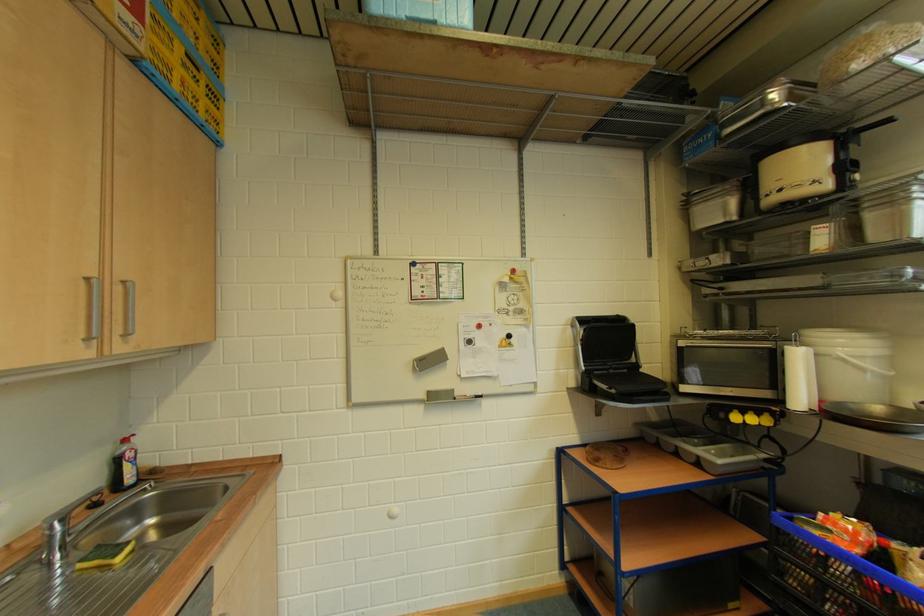
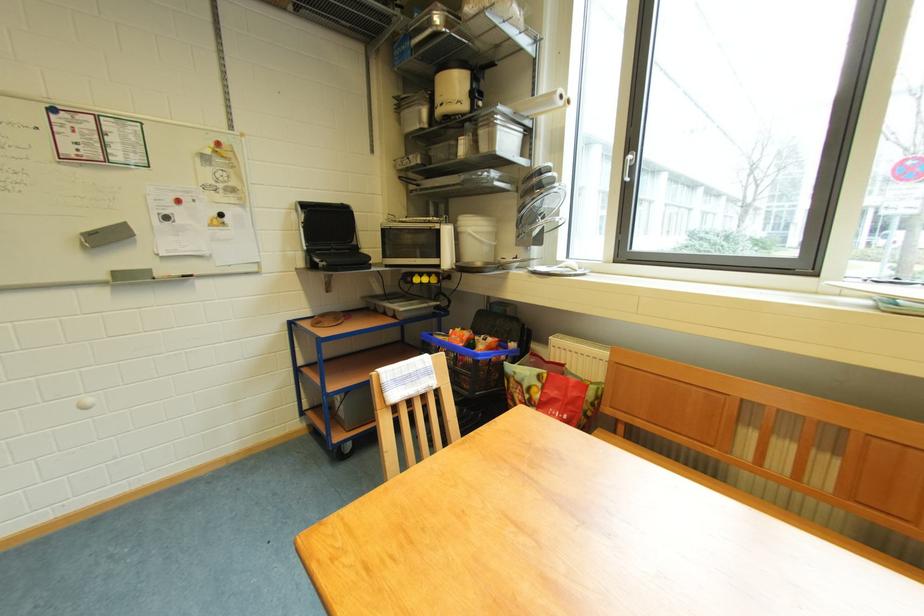
Where in the second image is the point corresponding to (x=872, y=208) from the first image?

(488, 127)